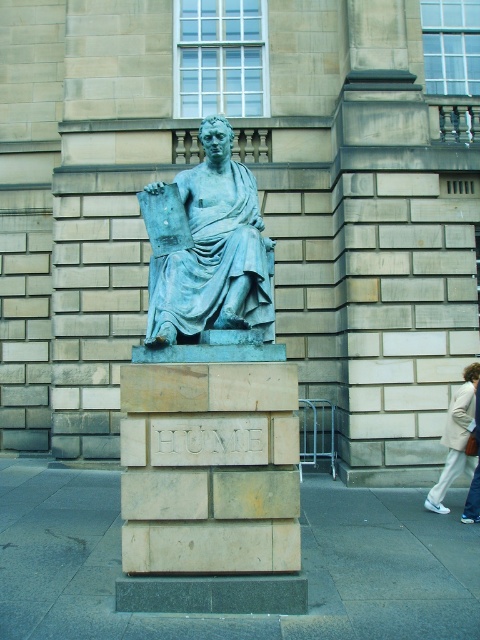
Can you confirm if green patina statue at center is positioned to the left of light beige pants at lower right?

Yes, green patina statue at center is to the left of light beige pants at lower right.

Does green patina statue at center have a greater width compared to light beige pants at lower right?

Correct, the width of green patina statue at center exceeds that of light beige pants at lower right.

Which is in front, point (215, 305) or point (471, 376)?

Point (215, 305) is in front.

The width and height of the screenshot is (480, 640). Find the location of `green patina statue at center`. green patina statue at center is located at coordinates (213, 252).